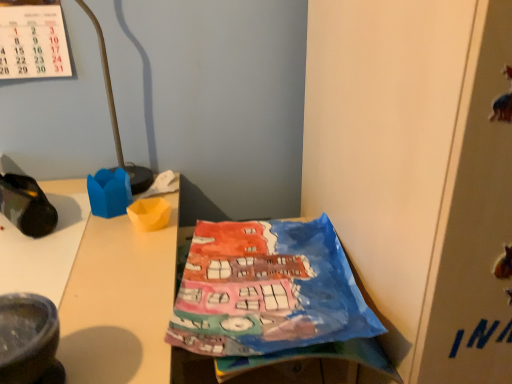
Find the location of a particular element. The width and height of the screenshot is (512, 384). empty space that is ontop of watercolor paper at center is located at coordinates (261, 328).